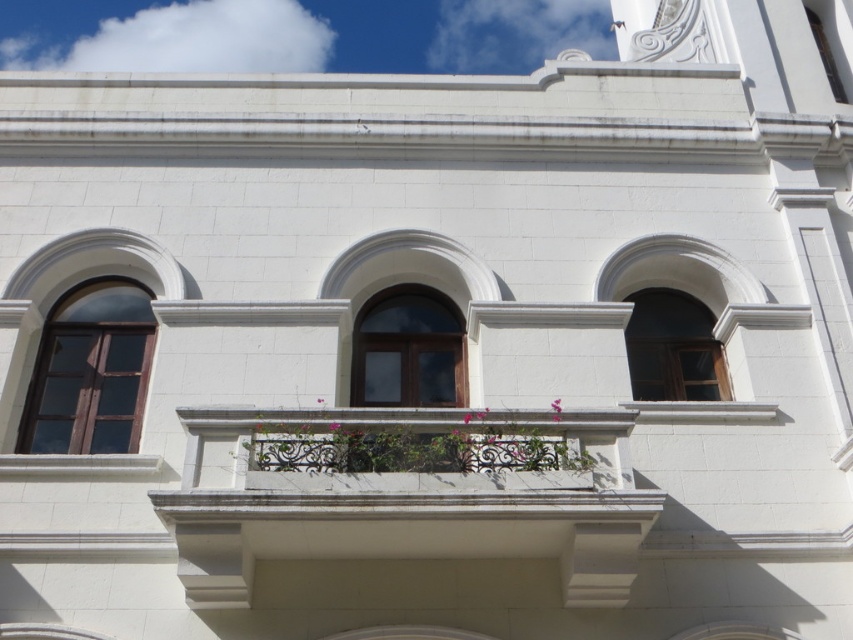
Question: Is matte brown wood window at left smaller than wooden window at center?

Choices:
 (A) yes
 (B) no

Answer: (B)

Question: Which of the following is the closest to the observer?

Choices:
 (A) (651, 497)
 (B) (721, 364)

Answer: (A)

Question: Does brown wooden window at center come behind pink matte flower at center?

Choices:
 (A) no
 (B) yes

Answer: (B)

Question: Is matte brown wood window at left closer to the viewer compared to wooden window at center?

Choices:
 (A) no
 (B) yes

Answer: (B)

Question: Which point is closer to the camera?

Choices:
 (A) wooden window at center
 (B) white stone balcony at center

Answer: (B)

Question: Which point is farther to the camera?

Choices:
 (A) brown wooden window at center
 (B) pink fabric flower at center
 (C) wooden window at center

Answer: (C)